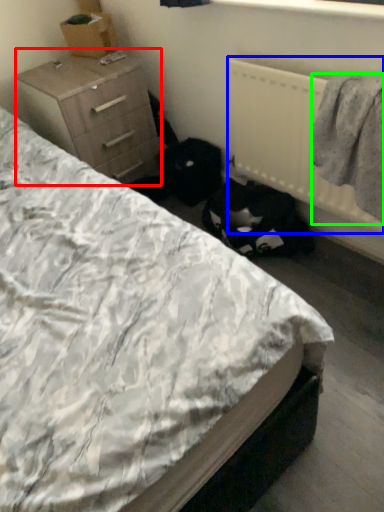
Question: Which object is the farthest from chest of drawers (highlighted by a red box)? Choose among these: radiator (highlighted by a blue box) or clothing (highlighted by a green box).

Choices:
 (A) radiator
 (B) clothing

Answer: (B)